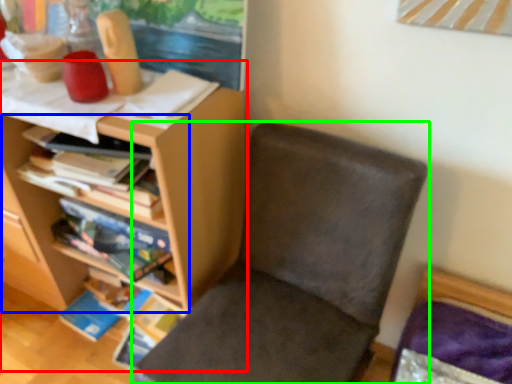
Question: Estimate the real-world distances between objects in this image. Which object is closer to shelf (highlighted by a red box), shelf (highlighted by a blue box) or chair (highlighted by a green box)?

Choices:
 (A) shelf
 (B) chair

Answer: (A)